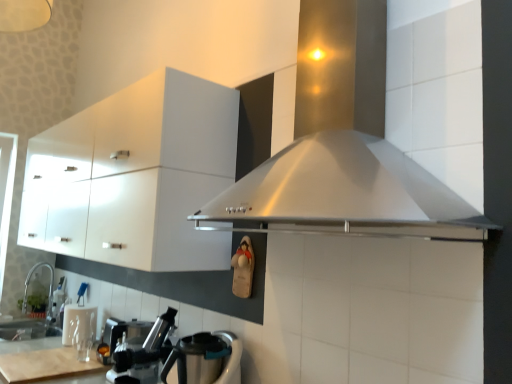
Question: Looking at their shapes, would you say wooden cutting board at lower left is wider or thinner than metallic silver coffee machine at lower left?

Choices:
 (A) wide
 (B) thin

Answer: (A)

Question: From a real-world perspective, is wooden cutting board at lower left physically located above or below metallic silver coffee machine at lower left?

Choices:
 (A) below
 (B) above

Answer: (A)

Question: Estimate the real-world distances between objects in this image. Which object is farther from the white glossy cabinet at upper left?

Choices:
 (A) stainless steel range hood at center
 (B) satin nickel faucet at lower left
 (C) stainless steel kettle at lower left
 (D) metallic silver coffee machine at lower left
 (E) wooden cutting board at lower left

Answer: (B)

Question: Considering the real-world distances, which object is farthest from the white glossy cabinet at upper left?

Choices:
 (A) metallic silver coffee machine at lower left
 (B) satin nickel faucet at lower left
 (C) stainless steel kettle at lower left
 (D) wooden cutting board at lower left
 (E) stainless steel range hood at center

Answer: (B)